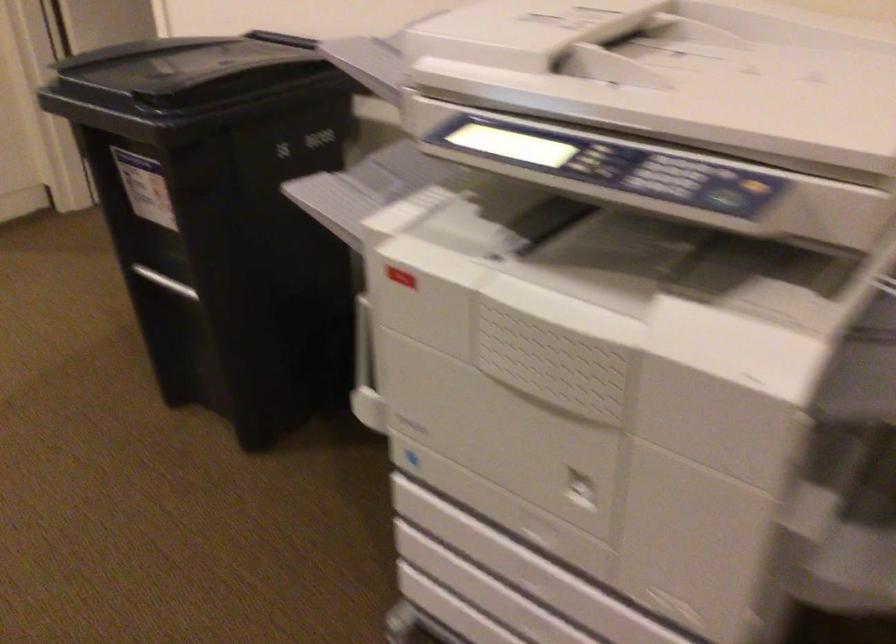
Locate an element on the screen. The height and width of the screenshot is (644, 896). printer side handle is located at coordinates (366, 373).